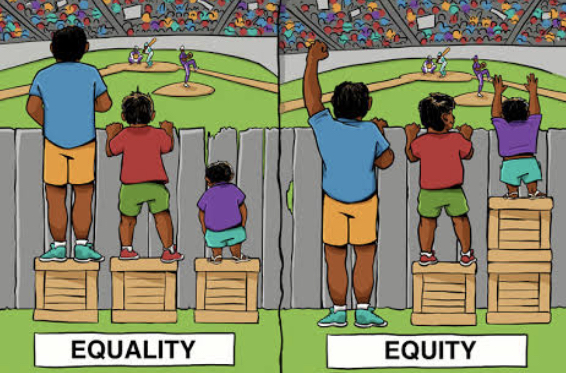
In order to click on stands in this screenshot , I will do `click(185, 26)`, `click(260, 21)`, `click(52, 8)`, `click(12, 32)`, `click(288, 28)`, `click(368, 23)`, `click(407, 3)`, `click(535, 23)`.